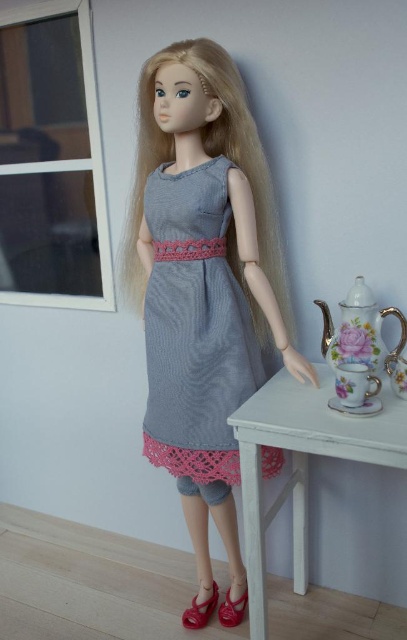
Which is in front, point (347, 328) or point (196, 620)?

Point (347, 328) is more forward.

Who is more distant from viewer, (x=352, y=332) or (x=194, y=604)?

Positioned behind is point (x=194, y=604).

Where is `porcelain floral teapot at right`? The image size is (407, 640). porcelain floral teapot at right is located at coordinates (358, 349).

Between knitted gray dress at center and porcelain floral teapot at right, which one has less height?

porcelain floral teapot at right is shorter.

Can you confirm if knitted gray dress at center is bigger than porcelain floral teapot at right?

Correct, knitted gray dress at center is larger in size than porcelain floral teapot at right.

Who is more forward, (153, 394) or (369, 328)?

Point (369, 328) is in front.

The height and width of the screenshot is (640, 407). Find the location of `knitted gray dress at center`. knitted gray dress at center is located at coordinates (203, 280).

Who is higher up, knitted denim dress at center or shiny red leather shoe at lower center?

Positioned higher is knitted denim dress at center.

Who is shorter, knitted denim dress at center or shiny red leather shoe at lower center?

shiny red leather shoe at lower center

Find the location of `knitted denim dress at center`. knitted denim dress at center is located at coordinates (194, 330).

You are a GUI agent. You are given a task and a screenshot of the screen. Output one action in this format:
    pyautogui.click(x=<x>, y=<y>)
    Task: Click on the knitted denim dress at center
    
    Given the screenshot: What is the action you would take?
    pyautogui.click(x=194, y=330)